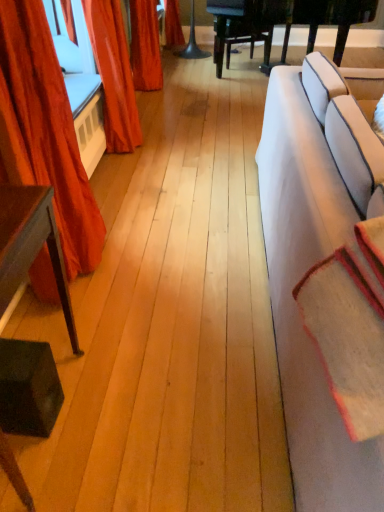
At what (x,y) coordinates should I click in order to perform the action: click on free space between velvet red curtain at left, acting as the 2th curtain starting from the back, and velvet orange curtain at upper left, which appears as the first curtain when viewed from the back. Please return your answer as a coordinate pair (x, y). The height and width of the screenshot is (512, 384). Looking at the image, I should click on (114, 184).